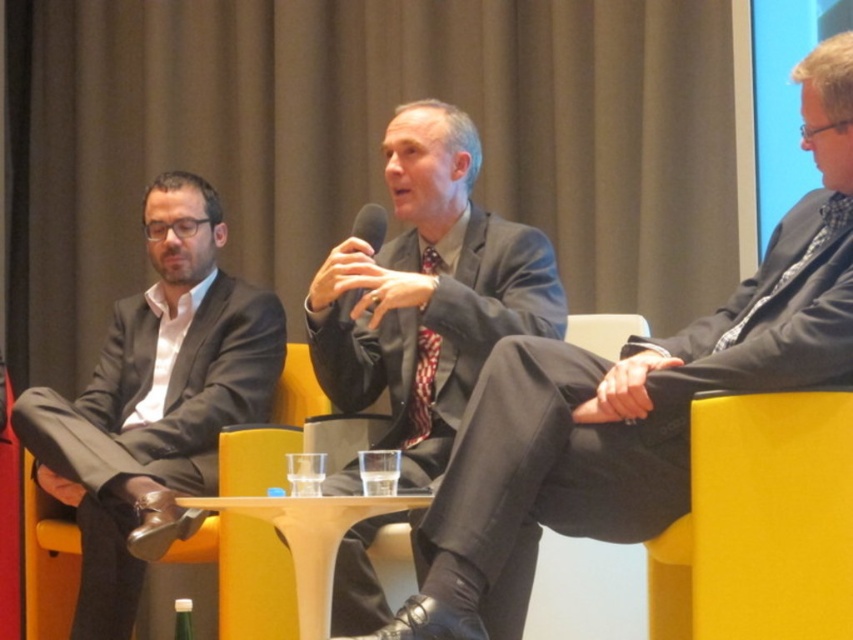
You are organizing a photo shoot and need to arrange the two men in the image based on their suit colors. If the matte black suit at left is wider than the matte gray suit at center, which suit should you place first in a row from left to right to maintain their original positions?

The matte black suit at left should be placed first in the row from left to right since it is wider than the matte gray suit at center, maintaining their original positions.

You are a photographer positioned behind the matte black suit at left and the black plastic microphone at center. You want to take a photo of the microphone without the suit blocking it. Is the microphone closer to you than the suit?

The matte black suit at left is further to the viewer than the black plastic microphone at center, so the microphone is closer to you. Therefore, the microphone will not be blocked by the suit in your photo.